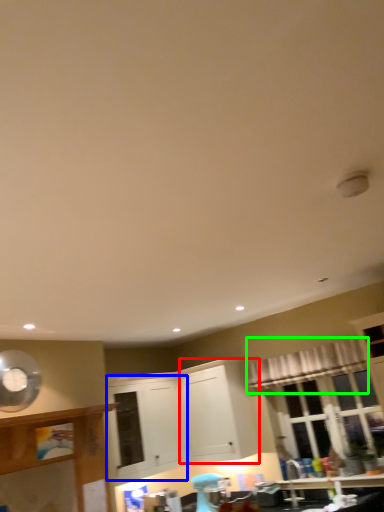
Question: Estimate the real-world distances between objects in this image. Which object is farther from cabinetry (highlighted by a red box), cabinetry (highlighted by a blue box) or curtain (highlighted by a green box)?

Choices:
 (A) cabinetry
 (B) curtain

Answer: (B)